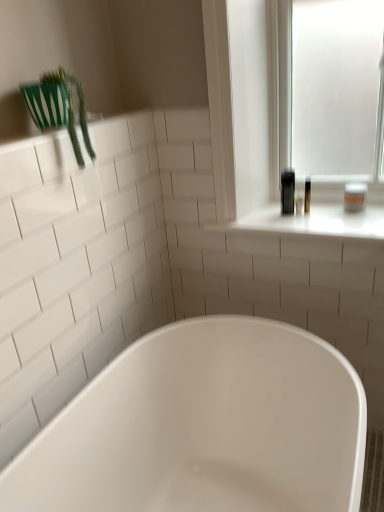
Question: Is white glossy bathtub at center located outside white glossy window sill at upper right?

Choices:
 (A) no
 (B) yes

Answer: (B)

Question: From a real-world perspective, is white glossy bathtub at center on top of white glossy window sill at upper right?

Choices:
 (A) yes
 (B) no

Answer: (B)

Question: From a real-world perspective, is white glossy bathtub at center located beneath white glossy window sill at upper right?

Choices:
 (A) no
 (B) yes

Answer: (B)

Question: From the image's perspective, is white glossy bathtub at center above white glossy window sill at upper right?

Choices:
 (A) yes
 (B) no

Answer: (B)

Question: Considering the relative sizes of white glossy bathtub at center and white glossy window sill at upper right in the image provided, is white glossy bathtub at center shorter than white glossy window sill at upper right?

Choices:
 (A) yes
 (B) no

Answer: (B)

Question: Would you say white glossy bathtub at center is a long distance from white glossy window sill at upper right?

Choices:
 (A) yes
 (B) no

Answer: (B)

Question: Is white glossy window sill at upper right smaller than white matte jar at upper right?

Choices:
 (A) no
 (B) yes

Answer: (A)

Question: Is white glossy window sill at upper right closer to the viewer compared to white matte jar at upper right?

Choices:
 (A) no
 (B) yes

Answer: (B)

Question: Is white glossy window sill at upper right facing towards white matte jar at upper right?

Choices:
 (A) yes
 (B) no

Answer: (B)

Question: From the image's perspective, would you say white glossy window sill at upper right is shown under white matte jar at upper right?

Choices:
 (A) no
 (B) yes

Answer: (B)

Question: Considering the relative sizes of white glossy window sill at upper right and white matte jar at upper right in the image provided, is white glossy window sill at upper right shorter than white matte jar at upper right?

Choices:
 (A) yes
 (B) no

Answer: (A)

Question: Is white glossy window sill at upper right touching white matte jar at upper right?

Choices:
 (A) yes
 (B) no

Answer: (B)

Question: From a real-world perspective, is green plastic plant at upper left positioned over white glossy window sill at upper right based on gravity?

Choices:
 (A) yes
 (B) no

Answer: (A)